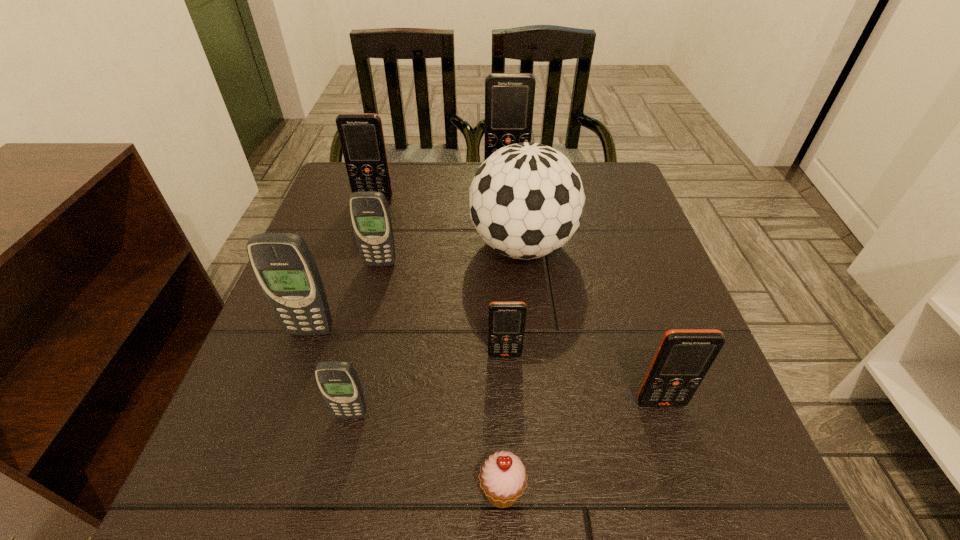
Identify the location of vacant space located on the screen of the biggest gray cellular telephone. (265, 460).

I want to click on free space located 0.200m on the screen of the fifth nearest cellular telephone, so click(x=362, y=341).

The height and width of the screenshot is (540, 960). Find the location of `vacant space situated 0.060m on the screen of the nearest orange cellular telephone`. vacant space situated 0.060m on the screen of the nearest orange cellular telephone is located at coordinates (675, 445).

What are the coordinates of `vacant space located 0.210m on the screen of the third nearest cellular telephone` in the screenshot? It's located at (511, 481).

Image resolution: width=960 pixels, height=540 pixels. Identify the location of free space located 0.080m on the screen of the smallest gray cellular telephone. (338, 470).

Locate an element on the screen. The height and width of the screenshot is (540, 960). vacant space situated 0.290m on the back of the nearest object is located at coordinates (496, 315).

I want to click on object located at the near edge, so click(x=503, y=478).

Identify the location of object that is at the right edge. The height and width of the screenshot is (540, 960). (684, 356).

The height and width of the screenshot is (540, 960). Find the location of `object situated at the far left corner`. object situated at the far left corner is located at coordinates (361, 135).

What are the coordinates of `blank area at the near edge` in the screenshot? It's located at (474, 492).